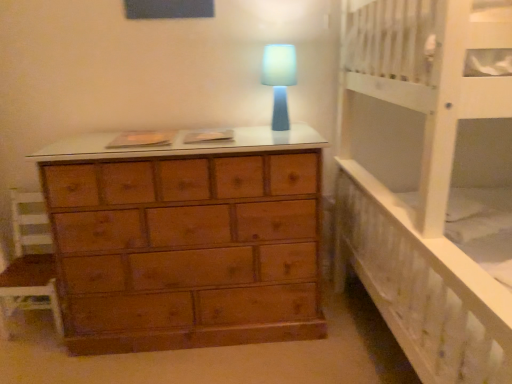
Question: Is wooden chair at left at the back of blue matte lamp at center?

Choices:
 (A) no
 (B) yes

Answer: (A)

Question: Does blue matte lamp at center have a greater width compared to wooden chair at left?

Choices:
 (A) no
 (B) yes

Answer: (A)

Question: From the image's perspective, is blue matte lamp at center beneath wooden chair at left?

Choices:
 (A) yes
 (B) no

Answer: (B)

Question: From a real-world perspective, does blue matte lamp at center sit lower than wooden chair at left?

Choices:
 (A) yes
 (B) no

Answer: (B)

Question: Does blue matte lamp at center have a greater height compared to wooden chair at left?

Choices:
 (A) yes
 (B) no

Answer: (B)

Question: From a real-world perspective, is blue matte lamp at center positioned over wooden chair at left based on gravity?

Choices:
 (A) no
 (B) yes

Answer: (B)

Question: Does blue matte lamp at center turn towards white wooden bed at right?

Choices:
 (A) no
 (B) yes

Answer: (A)

Question: Is blue matte lamp at center to the left of white wooden bed at right from the viewer's perspective?

Choices:
 (A) yes
 (B) no

Answer: (A)

Question: From a real-world perspective, does blue matte lamp at center stand above white wooden bed at right?

Choices:
 (A) yes
 (B) no

Answer: (A)

Question: Is blue matte lamp at center turned away from white wooden bed at right?

Choices:
 (A) no
 (B) yes

Answer: (A)

Question: Is blue matte lamp at center smaller than white wooden bed at right?

Choices:
 (A) no
 (B) yes

Answer: (B)

Question: Is blue matte lamp at center closer to the viewer compared to white wooden bed at right?

Choices:
 (A) no
 (B) yes

Answer: (A)

Question: Is white wooden bed at right wider than blue matte lamp at center?

Choices:
 (A) yes
 (B) no

Answer: (A)